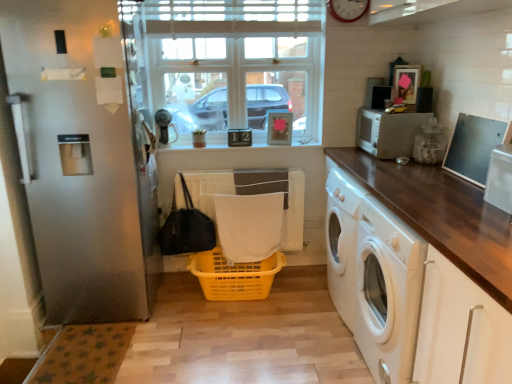
Question: Considering the relative positions of metallic silver microwave at right and dark wood countertop at right in the image provided, is metallic silver microwave at right to the left or to the right of dark wood countertop at right?

Choices:
 (A) left
 (B) right

Answer: (B)

Question: Would you say metallic silver microwave at right is inside or outside dark wood countertop at right?

Choices:
 (A) inside
 (B) outside

Answer: (B)

Question: Which is nearer to the white fabric at center?

Choices:
 (A) dark wood countertop at right
 (B) yellow plastic basket at center
 (C) white glass window at center
 (D) wooden clock at upper center
 (E) satin silver screen door at left

Answer: (B)

Question: Which of these objects is positioned closest to the white matte microwave at upper right?

Choices:
 (A) white fabric at center
 (B) white glass window at center
 (C) satin silver screen door at left
 (D) metallic silver microwave at right
 (E) yellow plastic basket at center

Answer: (B)